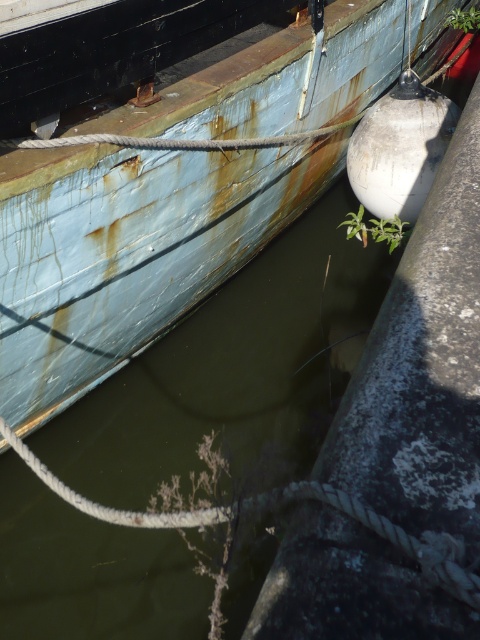
Question: Considering the real-world distances, which object is closest to the green leafy plant at upper right?

Choices:
 (A) rusty metal boat at upper left
 (B) green leafy plant at lower right

Answer: (B)

Question: Is rusty metal boat at upper left bigger than green leafy plant at upper right?

Choices:
 (A) no
 (B) yes

Answer: (B)

Question: Does rusty metal boat at upper left appear on the right side of green leafy plant at upper right?

Choices:
 (A) no
 (B) yes

Answer: (A)

Question: Is green murky water at center bigger than rusty metal boat at upper left?

Choices:
 (A) yes
 (B) no

Answer: (B)

Question: Which of the following is the closest to the observer?

Choices:
 (A) green leafy plant at lower right
 (B) green murky water at center
 (C) rusty metal boat at upper left

Answer: (C)

Question: Which of the following is the closest to the observer?

Choices:
 (A) green leafy plant at upper right
 (B) rusty metal boat at upper left

Answer: (B)